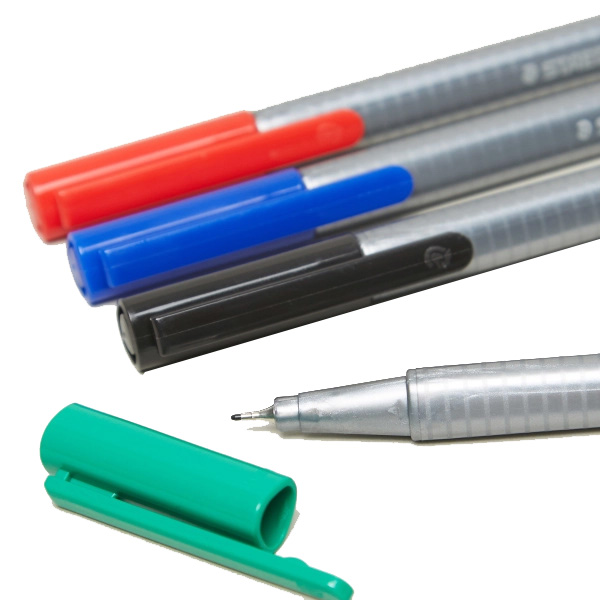
At what (x,y) coordinates should I click in order to perform the action: click on pen caps. Please return your answer as a coordinate pair (x, y). The width and height of the screenshot is (600, 600). Looking at the image, I should click on (148, 472), (228, 316), (138, 235), (55, 223).